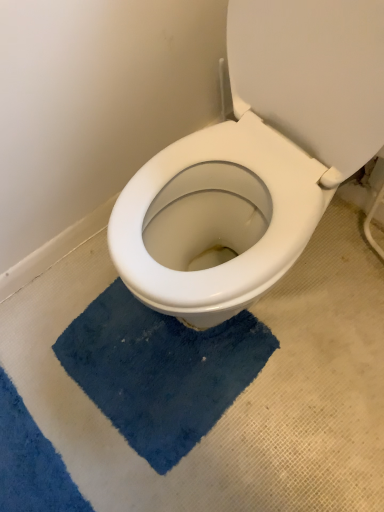
Identify the location of vacant area in front of blue plush bath mat at center. (200, 472).